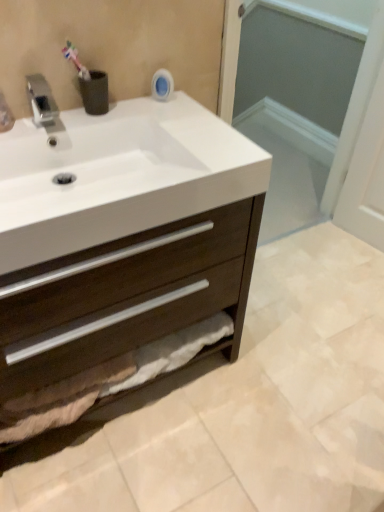
I want to click on vacant space to the right of dark wood cabinet at center, so click(272, 412).